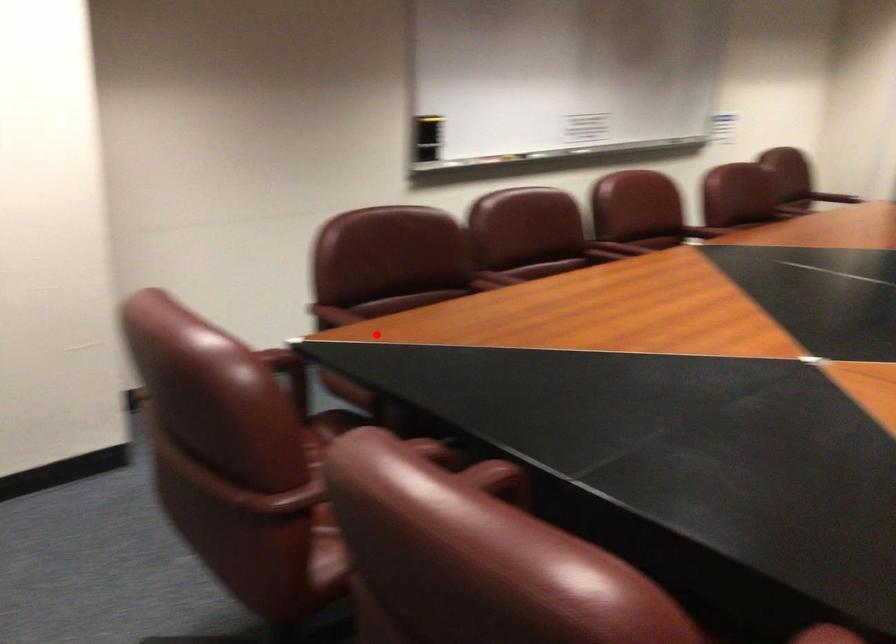
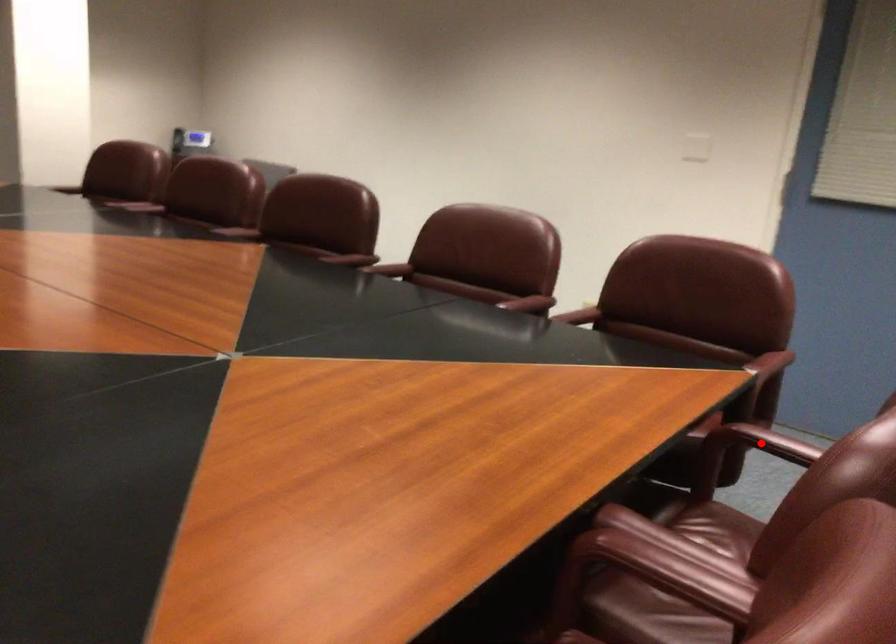
I am providing you with two images of the same scene from different viewpoints. A red point is marked on the first image and another point is marked on the second image. Is the red point in image1 aligned with the point shown in image2?

Yes